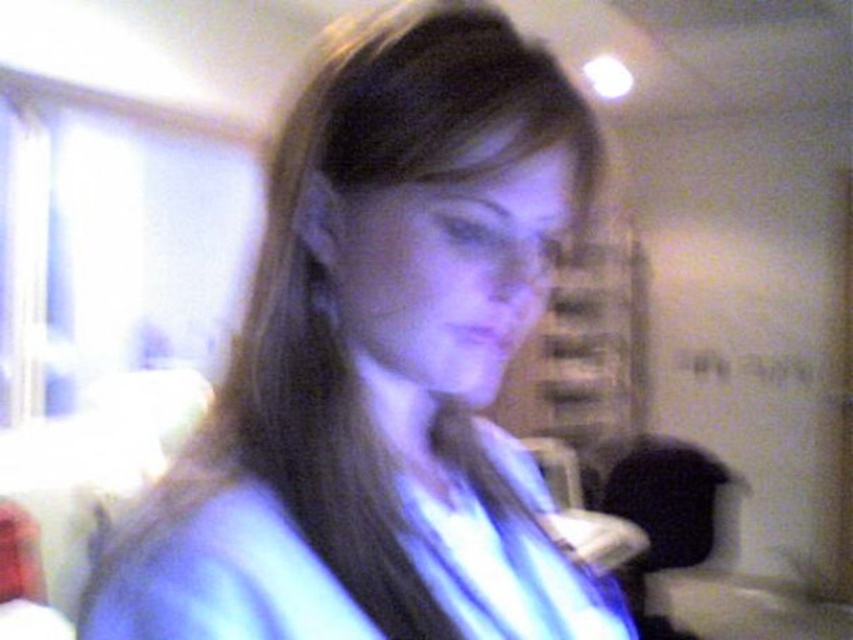
You are a fashion designer examining a model wearing two blue fabrics. The model has a blue fabric shirt at center and a blue fabric robe at center. Which one is nearer to you?

The blue fabric shirt at center is closer to the viewer than the blue fabric robe at center.

Looking at this image, you are taking a photo of two points in a dimly lit room with a bluish tint. The points are labeled as point 1 at coordinates point (508,474) and point 2 at coordinates point (152,582). Based on the scene description, which point is closer to the camera?

Point (152,582) is closer to the camera because the description states that point (508,474) is behind point (152,582).

You are a fashion designer trying to decide which blue fabric to use for a new collection. You have two options in front of you displayed in the image. The first is the blue fabric shirt at center and the second is the blue fabric robe at center. Based on their sizes in the image, which one is taller?

The blue fabric shirt at center is taller than the blue fabric robe at center.